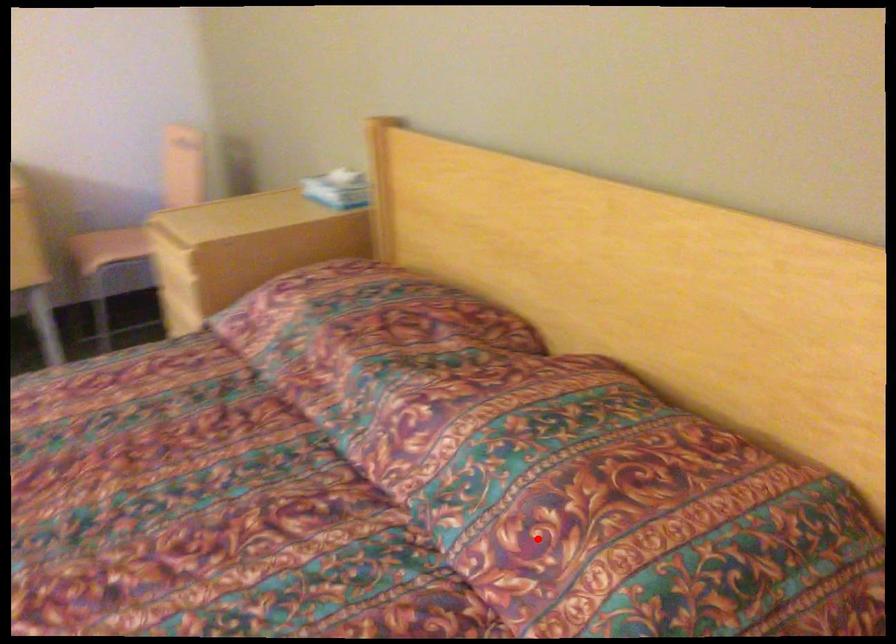
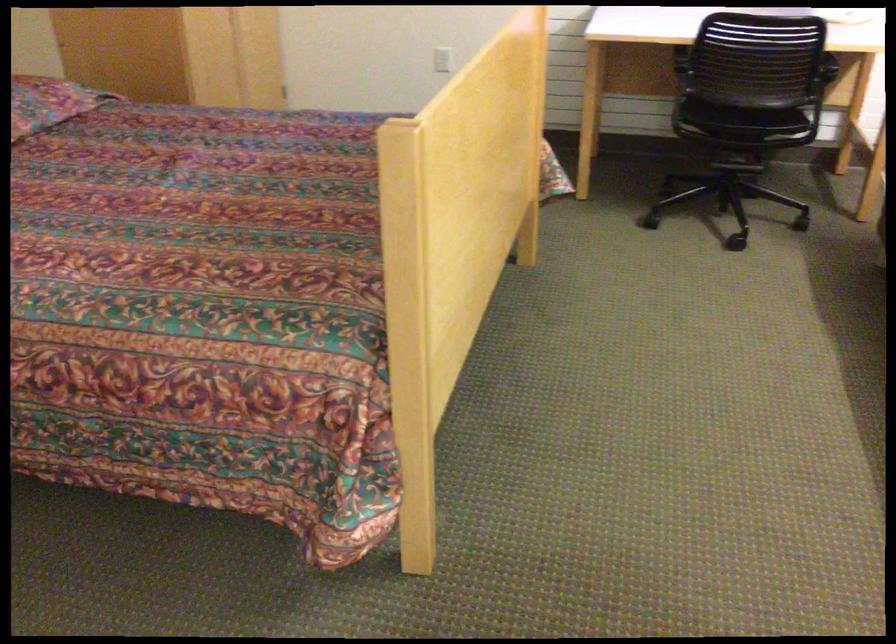
Question: I am providing you with two images of the same scene from different viewpoints. Image1 has a red point marked. In image2, the corresponding 3D location appears at what relative position? Reply with the corresponding letter.

Choices:
 (A) Closer
 (B) Farther

Answer: (B)